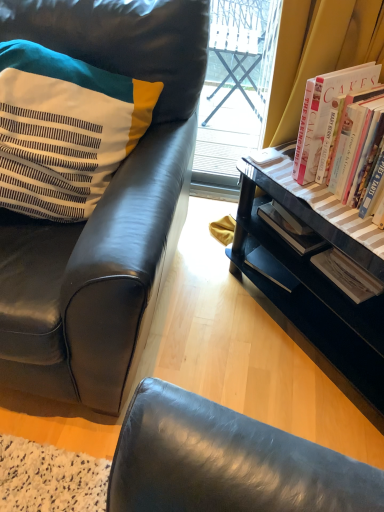
Question: From a real-world perspective, is striped fabric pillow at left above or below black wood desk at lower right?

Choices:
 (A) below
 (B) above

Answer: (B)

Question: Is striped fabric pillow at left to the left or to the right of black wood desk at lower right in the image?

Choices:
 (A) right
 (B) left

Answer: (B)

Question: Which object is positioned closest to the hardcover books at right?

Choices:
 (A) striped fabric pillow at left
 (B) black leather chair at left
 (C) black wood desk at lower right

Answer: (C)

Question: Which object is positioned farthest from the black wood desk at lower right?

Choices:
 (A) striped fabric pillow at left
 (B) black leather chair at left
 (C) hardcover books at right

Answer: (A)